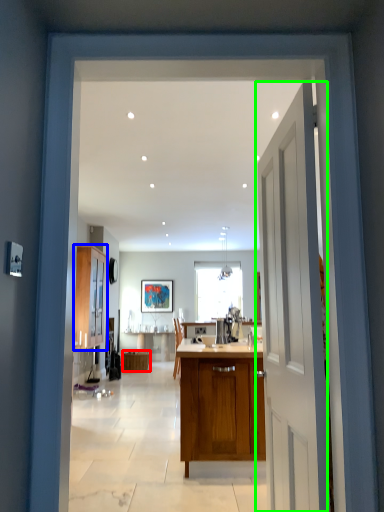
Question: Which object is positioned farthest from cabinetry (highlighted by a red box)? Select from cabinetry (highlighted by a blue box) and door (highlighted by a green box).

Choices:
 (A) cabinetry
 (B) door

Answer: (B)